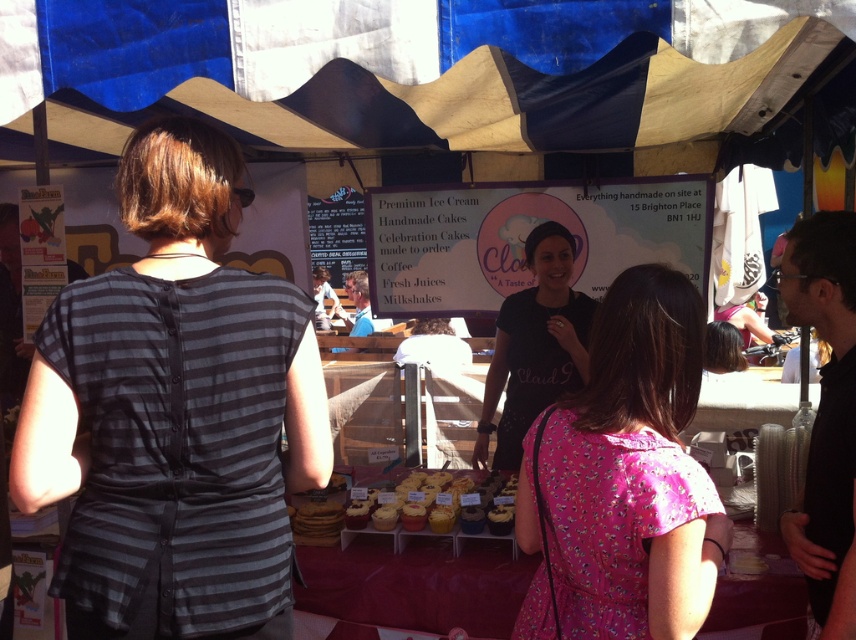
What is the 2D coordinate of the dark gray striped shirt at left?

The dark gray striped shirt at left is located at the 2D coordinate point of (175, 412).

You are a customer at the market stall and want to know which clothing item is shorter between the pink floral dress at center and the black matte shirt at center. Can you tell me which one is shorter?

The pink floral dress at center is shorter than the black matte shirt at center because it is not as tall as the shirt.

You are a customer at the market stall and want to buy both the pink floral dress at center and the black matte shirt at center. However, you have a limited budget and can only afford one. Based on their positions, which item is more likely to be on sale?

The pink floral dress at center is positioned under the black matte shirt at center, suggesting it might be on sale or discounted compared to the shirt.